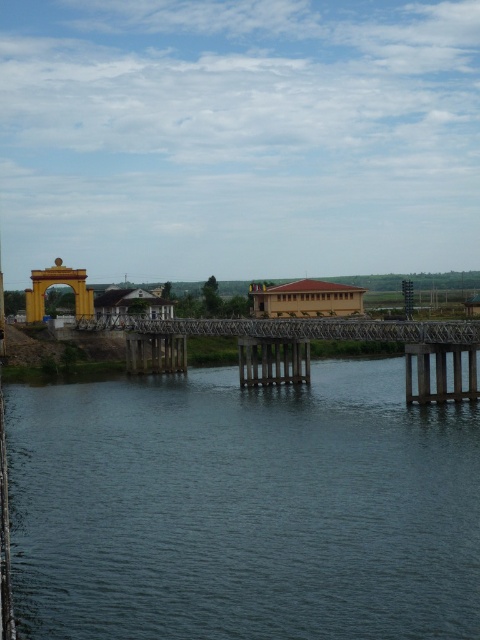
Question: Can you confirm if metallic bridge at center is thinner than gold metallic archway at left?

Choices:
 (A) yes
 (B) no

Answer: (B)

Question: Estimate the real-world distances between objects in this image. Which object is closer to the gold metallic archway at left?

Choices:
 (A) metallic bridge at center
 (B) dark blue water at center

Answer: (A)

Question: Is dark blue water at center above gold metallic archway at left?

Choices:
 (A) yes
 (B) no

Answer: (B)

Question: Does dark blue water at center appear under gold metallic archway at left?

Choices:
 (A) no
 (B) yes

Answer: (B)

Question: Which of the following is the farthest from the observer?

Choices:
 (A) dark blue water at center
 (B) gold metallic archway at left

Answer: (B)

Question: Which point is closer to the camera?

Choices:
 (A) (29, 308)
 (B) (25, 618)
 (C) (412, 326)

Answer: (B)